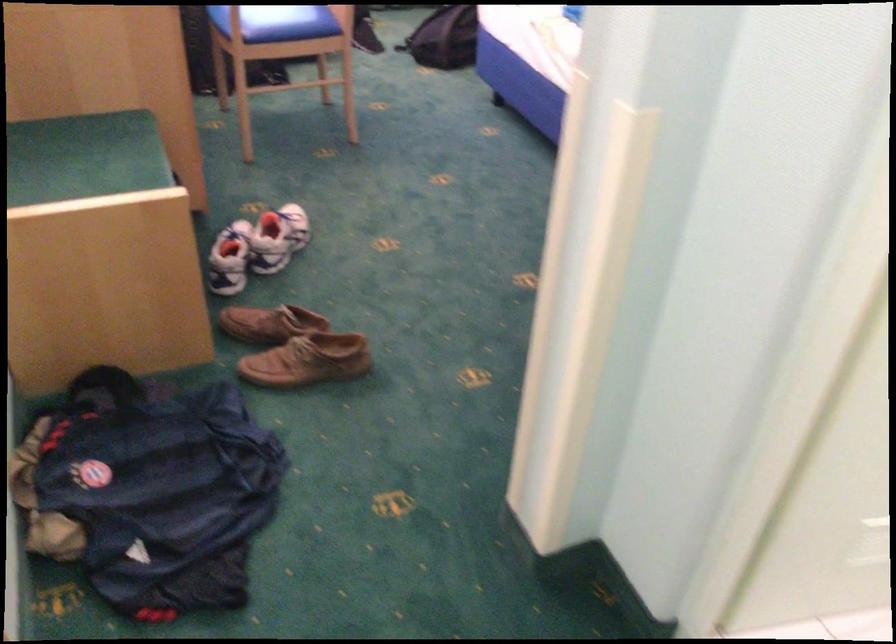
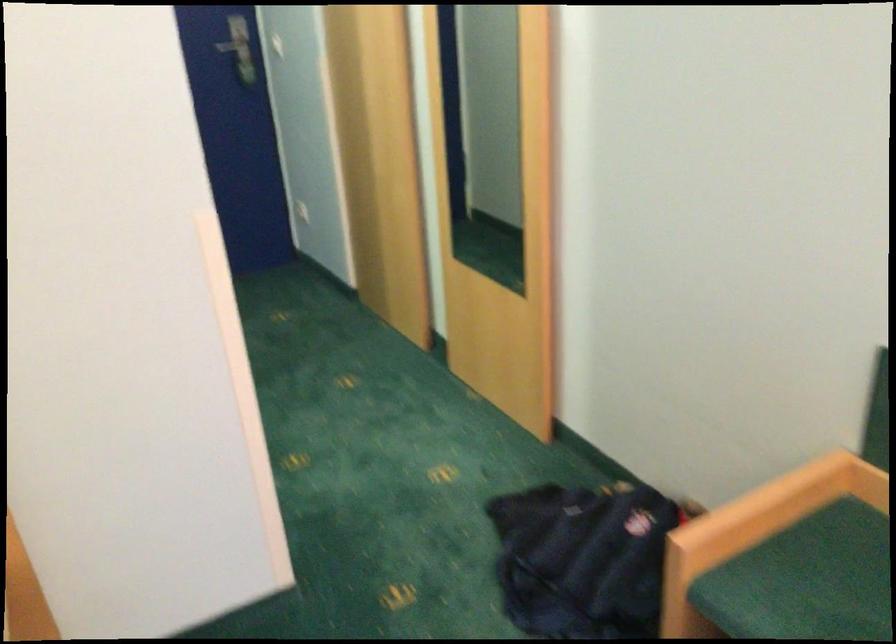
Where in the second image is the point corresponding to the point at 106,214 from the first image?

(756, 529)